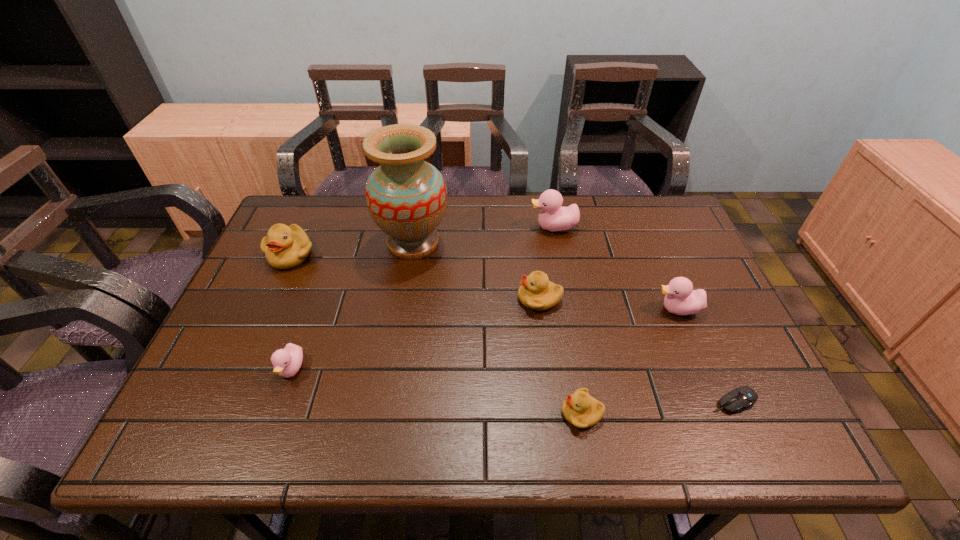
This screenshot has width=960, height=540. Find the location of `the smallest pink duckling`. the smallest pink duckling is located at coordinates (287, 362).

This screenshot has height=540, width=960. In order to click on the nearest duckling in this screenshot , I will do `click(580, 409)`.

I want to click on the nearest yellow duckling, so click(x=580, y=409).

This screenshot has width=960, height=540. What are the coordinates of `the shortest object` in the screenshot? It's located at (743, 398).

This screenshot has width=960, height=540. I want to click on free space located on the right of the sixth object from right to left, so click(x=504, y=243).

Find the location of a particular element. This screenshot has width=960, height=540. free spot located on the front-facing side of the farthest pink duckling is located at coordinates (514, 227).

This screenshot has width=960, height=540. Find the location of `vacant area situated 0.310m on the front-facing side of the farthest pink duckling`. vacant area situated 0.310m on the front-facing side of the farthest pink duckling is located at coordinates (429, 227).

At what (x,y) coordinates should I click in order to perform the action: click on vacant point located on the front-facing side of the farthest pink duckling. Please return your answer as a coordinate pair (x, y). The image size is (960, 540). Looking at the image, I should click on (407, 227).

Where is `blank area located 0.260m on the front-facing side of the leftmost yellow duckling`? The image size is (960, 540). blank area located 0.260m on the front-facing side of the leftmost yellow duckling is located at coordinates (249, 349).

This screenshot has height=540, width=960. What are the coordinates of `vacant space located 0.170m on the front-facing side of the rightmost duckling` in the screenshot? It's located at (588, 309).